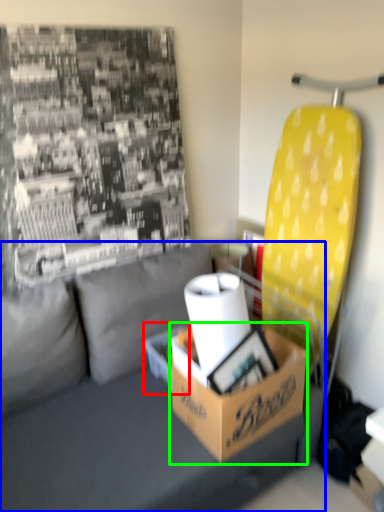
Question: Which object is the closest to the cardboard box (highlighted by a red box)? Choose among these: studio couch (highlighted by a blue box) or box (highlighted by a green box).

Choices:
 (A) studio couch
 (B) box

Answer: (A)